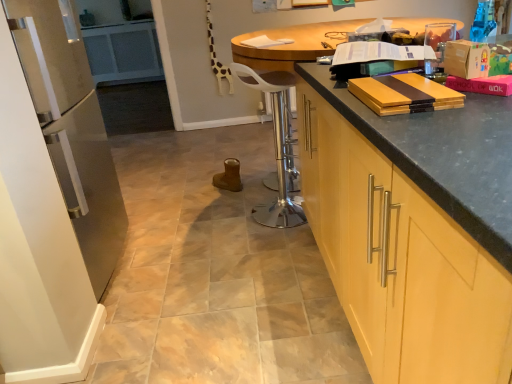
Locate an element on the screen. The image size is (512, 384). space that is in front of metallic silver bar stool at center is located at coordinates (271, 245).